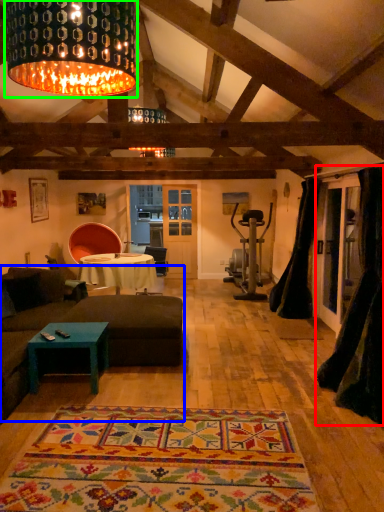
Question: Considering the real-world distances, which object is closest to curtain (highlighted by a red box)? studio couch (highlighted by a blue box) or lamp (highlighted by a green box).

Choices:
 (A) studio couch
 (B) lamp

Answer: (A)